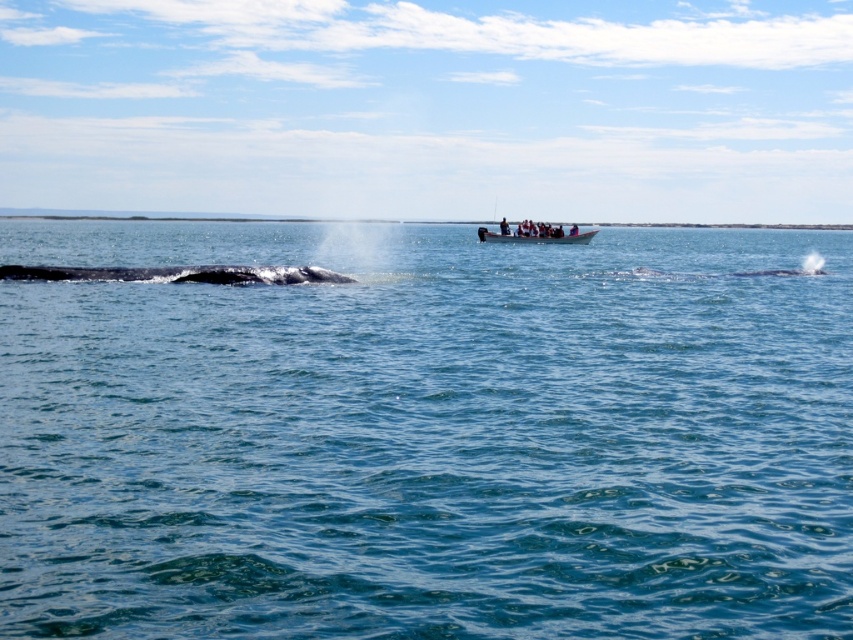
You are a photographer on the wooden boat at center aiming to capture a photo of the gray matte whale at left. Based on their positions, will the whale appear larger or smaller in your photo compared to its actual size?

The gray matte whale at left is closer to the viewer than the wooden boat at center, so the whale will appear larger in the photo compared to its actual size because it is nearer to the camera.

You are standing on the deck of the motorboat in the middle ground. You see the clear blue water at center and the gray matte whale at left. How far apart are these two objects from each other?

The clear blue water at center is 109.58 feet away from the gray matte whale at left.